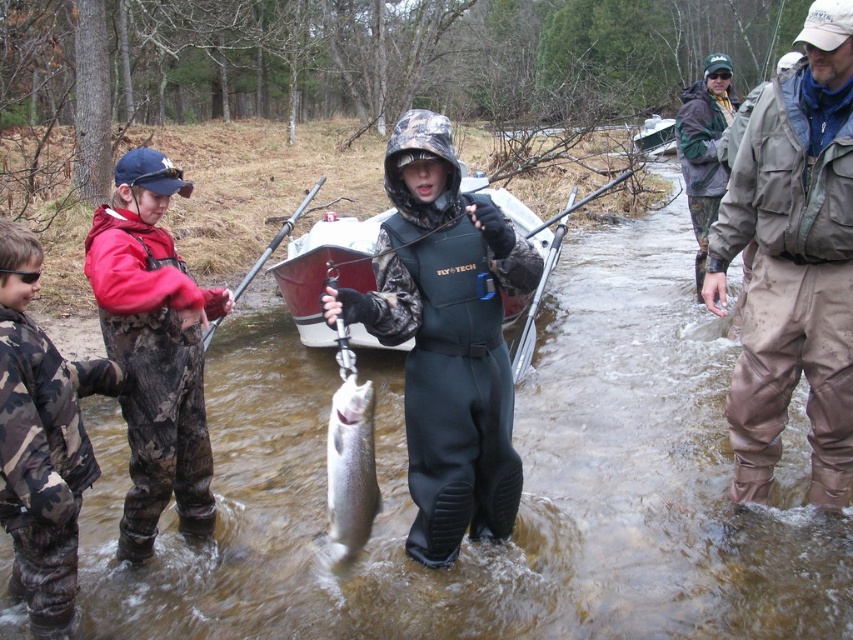
You are standing at the point with coordinates (41, 440) in the image. What object is located at this point?

The point at coordinates (41, 440) indicates camo pants at left.

You are a hiker trying to cross the stream. You see two people wearing khaki waterproof pants at right and red camo waders at left. Which clothing item is wider to provide more stability while crossing?

The khaki waterproof pants at right are wider than the red camo waders at left, so they would provide more stability while crossing the stream.